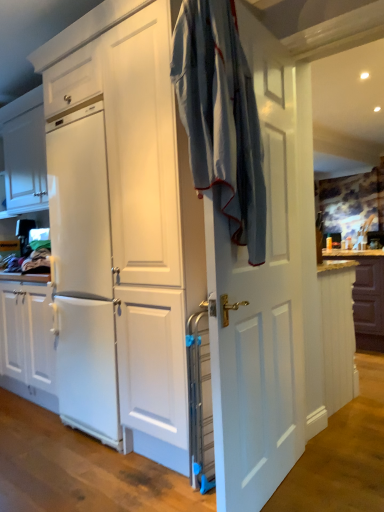
The image size is (384, 512). What are the coordinates of `white matte door at center` in the screenshot? It's located at (259, 303).

In the scene shown: Measure the distance between point [351,276] and camera.

Point [351,276] and camera are 2.80 meters apart from each other.

Describe the element at coordinates (338, 332) in the screenshot. The width and height of the screenshot is (384, 512). I see `white matte cabinet at right` at that location.

Identify the location of light blue fabric at center. The width and height of the screenshot is (384, 512). (221, 117).

The width and height of the screenshot is (384, 512). Describe the element at coordinates (221, 117) in the screenshot. I see `light blue fabric at center` at that location.

You are a GUI agent. You are given a task and a screenshot of the screen. Output one action in this format:
    pyautogui.click(x=<x>, y=<y>)
    Task: Click on the white matte door at center
    The width and height of the screenshot is (384, 512).
    Given the screenshot: What is the action you would take?
    pyautogui.click(x=259, y=303)

Which is in front, white matte door at center or brown wood countertop at right?

white matte door at center.

Identify the location of door that is on the left side of brown wood countertop at right. This screenshot has height=512, width=384. (259, 303).

Which is closer, [290,273] or [360,300]?

The point [290,273] is in front.

Considering the sizes of white matte cabinet at right and brown wood countertop at right in the image, is white matte cabinet at right taller or shorter than brown wood countertop at right?

Considering their sizes, white matte cabinet at right has more height than brown wood countertop at right.

Is white matte cabinet at right oriented towards brown wood countertop at right?

No.

Would you consider white matte cabinet at right to be distant from brown wood countertop at right?

white matte cabinet at right is positioned a significant distance from brown wood countertop at right.

Can you tell me how much white matte cabinet at right and brown wood countertop at right differ in facing direction?

The angle between the facing direction of white matte cabinet at right and the facing direction of brown wood countertop at right is 0.556 degrees.

How much distance is there between white matte cabinet at right and white matte door at center?

A distance of 29.99 inches exists between white matte cabinet at right and white matte door at center.

Would you say white matte cabinet at right is a long distance from white matte door at center?

white matte cabinet at right is actually quite close to white matte door at center.

From a real-world perspective, between white matte cabinet at right and white matte door at center, who is vertically lower?

white matte cabinet at right.

Which of these two, white matte cabinet at right or white matte door at center, is bigger?

white matte door at center.

From a real-world perspective, does light blue fabric at center stand above brown wood countertop at right?

Yes.

From the image's perspective, which one is positioned lower, light blue fabric at center or brown wood countertop at right?

From the image's view, brown wood countertop at right is below.

Considering the positions of points (221, 84) and (357, 287), is point (221, 84) closer to camera compared to point (357, 287)?

Yes, point (221, 84) is in front of point (357, 287).

Based on the photo, is brown wood countertop at right in front of or behind white matte door at center in the image?

In the image, brown wood countertop at right appears behind white matte door at center.

From the image's perspective, between brown wood countertop at right and white matte door at center, which one is located above?

white matte door at center appears higher in the image.

From the picture: Is brown wood countertop at right looking in the opposite direction of white matte door at center?

That's not correct — brown wood countertop at right is not looking away from white matte door at center.

Is light blue fabric at center aimed at white matte cabinet at right?

No, light blue fabric at center does not turn towards white matte cabinet at right.

Does light blue fabric at center have a smaller size compared to white matte cabinet at right?

Yes, light blue fabric at center is smaller than white matte cabinet at right.

From a real-world perspective, which is physically below, light blue fabric at center or white matte cabinet at right?

white matte cabinet at right is physically lower.

Which is more to the left, light blue fabric at center or white matte cabinet at right?

light blue fabric at center is more to the left.

Considering the positions of point (377, 318) and point (249, 174), is point (377, 318) closer or farther from the camera than point (249, 174)?

Point (377, 318).

Is brown wood countertop at right next to light blue fabric at center?

No, brown wood countertop at right is not in contact with light blue fabric at center.

Is brown wood countertop at right taller than light blue fabric at center?

No, brown wood countertop at right is not taller than light blue fabric at center.

Find the location of a particular element. counter that appears on the right of white matte door at center is located at coordinates (366, 296).

Identify the location of cabinetry that appears in front of the brown wood countertop at right. The height and width of the screenshot is (512, 384). (338, 332).

Considering their positions, is white matte door at center positioned further to brown wood countertop at right than white matte cabinet at right?

The object further to brown wood countertop at right is white matte door at center.

When comparing their distances from white matte cabinet at right, does brown wood countertop at right or white matte door at center seem closer?

Based on the image, white matte door at center appears to be nearer to white matte cabinet at right.

When comparing their distances from light blue fabric at center, does white matte door at center or white matte cabinet at right seem further?

The object further to light blue fabric at center is white matte cabinet at right.

Based on their spatial positions, is white matte door at center or brown wood countertop at right further from light blue fabric at center?

brown wood countertop at right.

From the image, which object appears to be farther from light blue fabric at center, brown wood countertop at right or white matte door at center?

brown wood countertop at right is positioned further to the anchor light blue fabric at center.

Considering their positions, is white matte door at center positioned further to white matte cabinet at right than brown wood countertop at right?

Based on the image, brown wood countertop at right appears to be further to white matte cabinet at right.

From the image, which object appears to be farther from white matte cabinet at right, brown wood countertop at right or light blue fabric at center?

brown wood countertop at right is further to white matte cabinet at right.

Looking at the image, which one is located further to brown wood countertop at right, light blue fabric at center or white matte door at center?

light blue fabric at center lies further to brown wood countertop at right than the other object.

You are a GUI agent. You are given a task and a screenshot of the screen. Output one action in this format:
    pyautogui.click(x=<x>, y=<y>)
    Task: Click on the cabinetry positioned between light blue fabric at center and brown wood countertop at right from near to far
    This screenshot has height=512, width=384.
    Given the screenshot: What is the action you would take?
    pyautogui.click(x=338, y=332)

The image size is (384, 512). What are the coordinates of `door between light blue fabric at center and brown wood countertop at right in the front-back direction` in the screenshot? It's located at (259, 303).

Where is `door between light blue fabric at center and white matte cabinet at right from front to back`? The image size is (384, 512). door between light blue fabric at center and white matte cabinet at right from front to back is located at coordinates (259, 303).

Where is `cabinetry between white matte door at center and brown wood countertop at right along the z-axis`? Image resolution: width=384 pixels, height=512 pixels. cabinetry between white matte door at center and brown wood countertop at right along the z-axis is located at coordinates (338, 332).